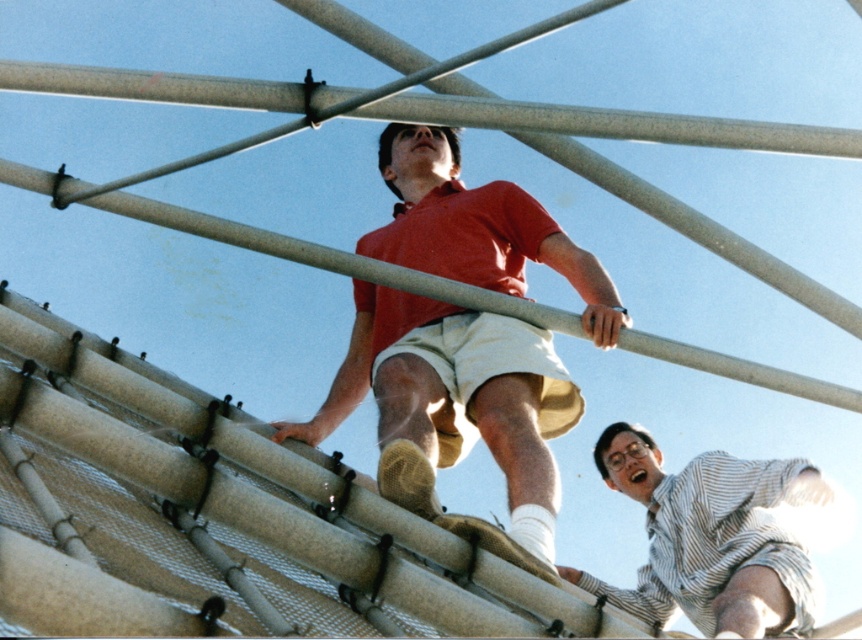
Question: Is matte red shirt at upper center below striped cotton shirt at upper right?

Choices:
 (A) yes
 (B) no

Answer: (B)

Question: Which point is farther to the camera?

Choices:
 (A) (390, 177)
 (B) (713, 604)

Answer: (A)

Question: Does matte red shirt at upper center come behind striped cotton shirt at upper right?

Choices:
 (A) yes
 (B) no

Answer: (B)

Question: Does matte red shirt at upper center appear under striped cotton shirt at upper right?

Choices:
 (A) no
 (B) yes

Answer: (A)

Question: Which point is closer to the camera?

Choices:
 (A) striped cotton shirt at upper right
 (B) matte red shirt at upper center

Answer: (B)